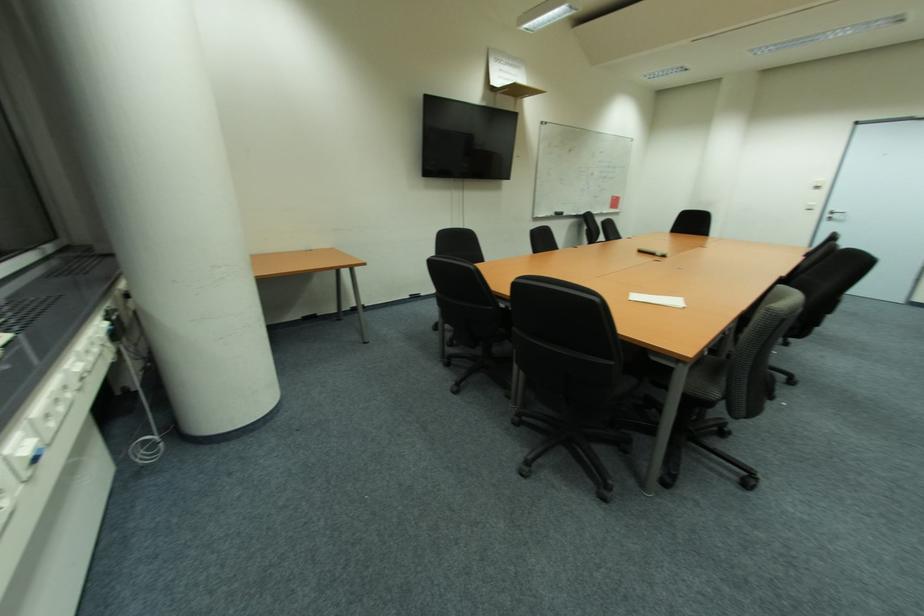
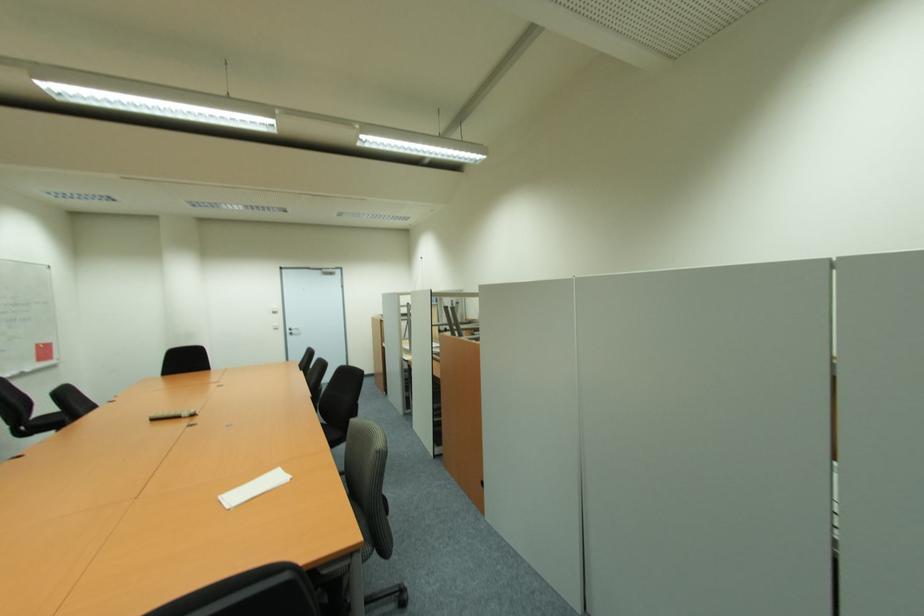
Question: The images are taken continuously from a first-person perspective. In which direction is your viewpoint rotating?

Choices:
 (A) Left
 (B) Right
 (C) Up
 (D) Down

Answer: (B)